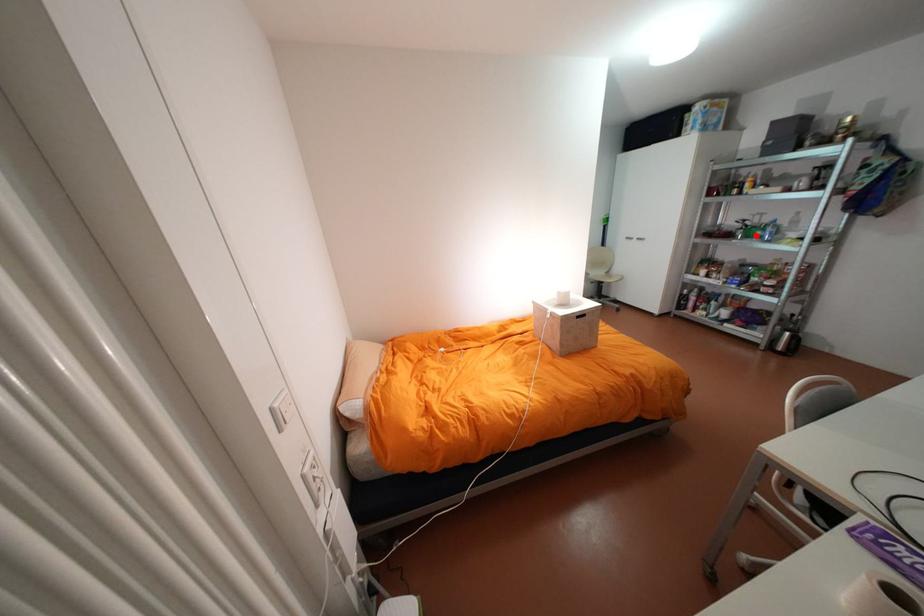
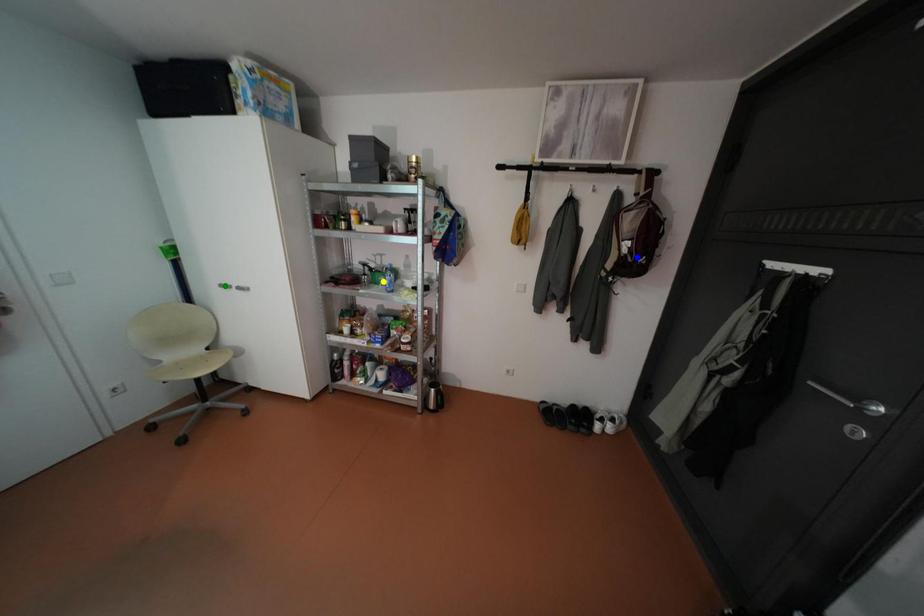
Question: I am providing you with two images of the same scene from different viewpoints. A red point is marked on the first image. You are given multiple points on the second image. Can you choose the point in image 2 that corresponds to the point in image 1?

Choices:
 (A) yellow point
 (B) green point
 (C) blue point

Answer: (A)